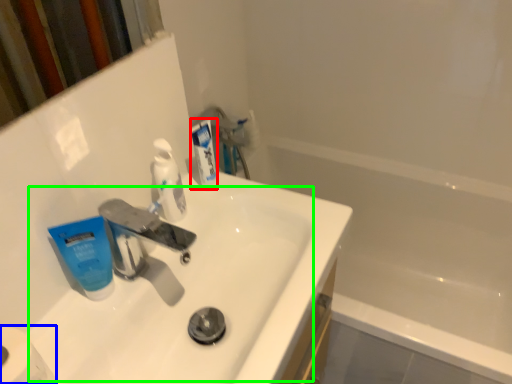
Question: Based on their relative distances, which object is farther from toothpaste (highlighted by a red box)? Choose from toilet paper (highlighted by a blue box) and sink (highlighted by a green box).

Choices:
 (A) toilet paper
 (B) sink

Answer: (A)